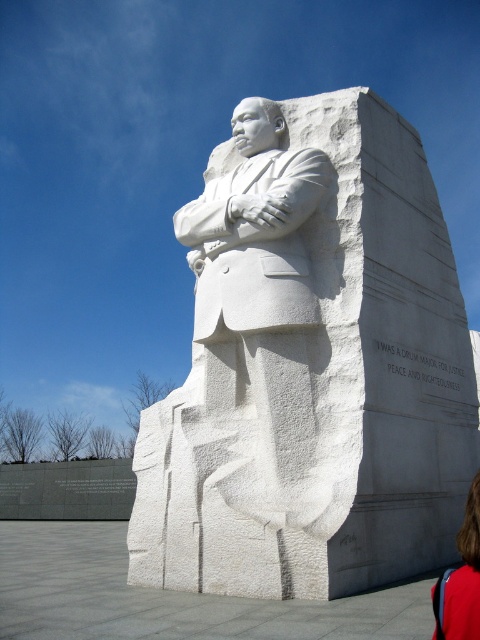
Does point (399, 472) lie in front of point (468, 518)?

No, (399, 472) is behind (468, 518).

Between point (255, 189) and point (462, 634), which one is positioned behind?

The point (255, 189) is more distant.

Does point (350, 365) lie in front of point (452, 621)?

No, it is behind (452, 621).

I want to click on white marble statue at center, so click(x=311, y=365).